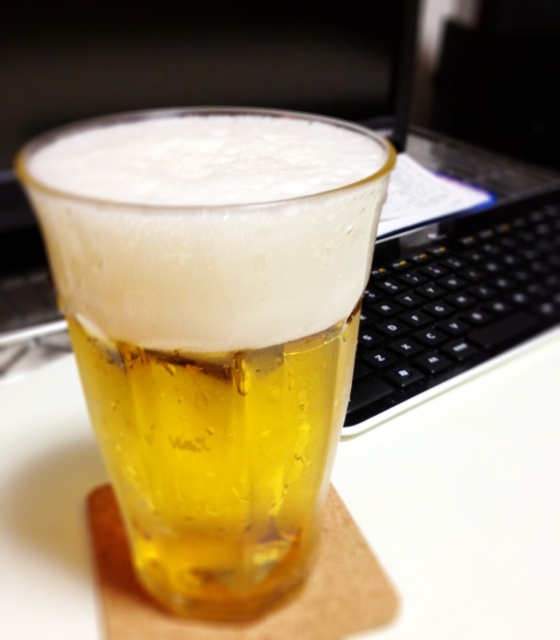
Question: Is the position of translucent glass at center less distant than that of black plastic keyboard at right?

Choices:
 (A) yes
 (B) no

Answer: (A)

Question: Which point is farther to the camera?

Choices:
 (A) (192, 388)
 (B) (370, 301)

Answer: (B)

Question: Can you confirm if translucent glass at center is wider than black plastic keyboard at right?

Choices:
 (A) no
 (B) yes

Answer: (A)

Question: Can you confirm if translucent glass at center is smaller than black plastic keyboard at right?

Choices:
 (A) yes
 (B) no

Answer: (A)

Question: Which of the following is the farthest from the observer?

Choices:
 (A) black plastic keyboard at right
 (B) translucent glass at center

Answer: (A)

Question: Which object is farther from the camera taking this photo?

Choices:
 (A) black plastic keyboard at right
 (B) translucent glass at center

Answer: (A)